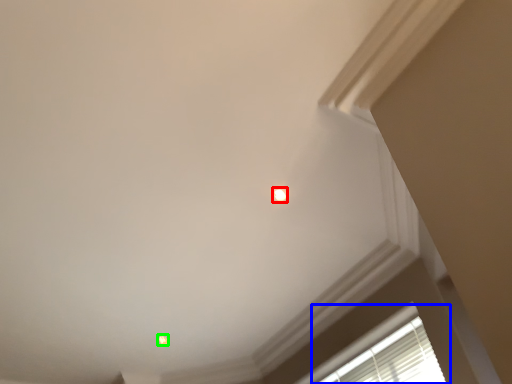
Question: Estimate the real-world distances between objects in this image. Which object is closer to dot (highlighted by a red box), window (highlighted by a blue box) or dot (highlighted by a green box)?

Choices:
 (A) window
 (B) dot

Answer: (A)